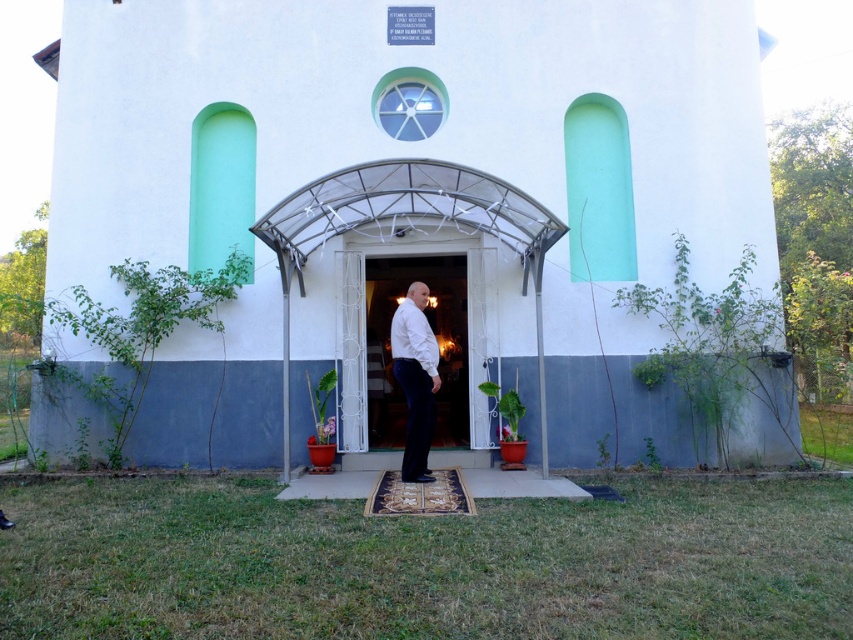
Can you confirm if white matte chapel at center is positioned below white wooden door at center?

Incorrect, white matte chapel at center is not positioned below white wooden door at center.

Which is more to the right, white matte chapel at center or white wooden door at center?

Positioned to the right is white wooden door at center.

Between point (196, 230) and point (399, 445), which one is positioned in front?

Positioned in front is point (196, 230).

In order to click on white matte chapel at center in this screenshot , I will do (409, 193).

Between white matte chapel at center and white matte shirt at center, which one has more height?

Standing taller between the two is white matte chapel at center.

Based on the photo, which is more to the left, white matte chapel at center or white matte shirt at center?

Positioned to the left is white matte chapel at center.

Who is more distant from viewer, (453, 1) or (413, 451)?

Positioned behind is point (453, 1).

What are the coordinates of `white matte chapel at center` in the screenshot? It's located at (409, 193).

Based on the photo, does white wooden door at center appear over white matte shirt at center?

Indeed, white wooden door at center is positioned over white matte shirt at center.

In the scene shown: Can you confirm if white wooden door at center is thinner than white matte shirt at center?

In fact, white wooden door at center might be wider than white matte shirt at center.

Is point (451, 296) positioned after point (428, 365)?

Yes, it is behind point (428, 365).

Image resolution: width=853 pixels, height=640 pixels. I want to click on white wooden door at center, so click(434, 336).